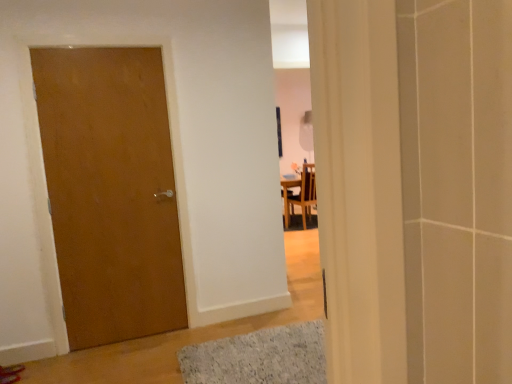
Describe the element at coordinates (110, 192) in the screenshot. I see `matte wood door at left` at that location.

The width and height of the screenshot is (512, 384). Find the location of `matte wood door at left`. matte wood door at left is located at coordinates (110, 192).

Can you confirm if matte wood door at left is shorter than wooden chair at center?

No, matte wood door at left is not shorter than wooden chair at center.

Is wooden chair at center completely or partially inside matte wood door at left?

Actually, wooden chair at center is outside matte wood door at left.

From the image's perspective, which one is positioned higher, matte wood door at left or wooden chair at center?

wooden chair at center.

From a real-world perspective, is matte wood door at left above or below wooden chair at center?

matte wood door at left is situated higher than wooden chair at center in the real world.

Is wooden chair at center positioned with its back to gray textured bath mat at lower center?

That's not correct — wooden chair at center is not looking away from gray textured bath mat at lower center.

Can we say wooden chair at center lies outside gray textured bath mat at lower center?

wooden chair at center is positioned outside gray textured bath mat at lower center.

Does wooden chair at center appear on the right side of gray textured bath mat at lower center?

Yes.

Which object is more forward, wooden chair at center or gray textured bath mat at lower center?

gray textured bath mat at lower center is in front.

From a real-world perspective, is gray textured bath mat at lower center physically above matte wood door at left?

Incorrect, from a real-world perspective, gray textured bath mat at lower center is lower than matte wood door at left.

Could you tell me if gray textured bath mat at lower center is facing matte wood door at left?

No.

Is point (278, 348) behind point (132, 85)?

No, (278, 348) is in front of (132, 85).

Is gray textured bath mat at lower center placed right next to matte wood door at left?

No, gray textured bath mat at lower center is not beside matte wood door at left.

Is wooden chair at center bigger than matte wood door at left?

Indeed, wooden chair at center has a larger size compared to matte wood door at left.

From a real-world perspective, is wooden chair at center located beneath matte wood door at left?

Yes, from a real-world perspective, wooden chair at center is below matte wood door at left.

In the scene shown: Can you confirm if wooden chair at center is wider than matte wood door at left?

Yes, wooden chair at center is wider than matte wood door at left.

Is wooden chair at center taller or shorter than matte wood door at left?

Clearly, wooden chair at center is shorter compared to matte wood door at left.

From the image's perspective, is matte wood door at left under gray textured bath mat at lower center?

No.

Considering the relative positions of matte wood door at left and gray textured bath mat at lower center in the image provided, is matte wood door at left to the left of gray textured bath mat at lower center from the viewer's perspective?

Correct, you'll find matte wood door at left to the left of gray textured bath mat at lower center.

Is gray textured bath mat at lower center surrounded by matte wood door at left?

No, gray textured bath mat at lower center is not inside matte wood door at left.

In the scene shown: Which object is thinner, matte wood door at left or gray textured bath mat at lower center?

matte wood door at left.

Is gray textured bath mat at lower center completely or partially outside of wooden chair at center?

Yes, gray textured bath mat at lower center is not within wooden chair at center.

Is gray textured bath mat at lower center directly adjacent to wooden chair at center?

No, gray textured bath mat at lower center is not next to wooden chair at center.

Based on the photo, which of these two, gray textured bath mat at lower center or wooden chair at center, stands shorter?

gray textured bath mat at lower center is shorter.

The width and height of the screenshot is (512, 384). What are the coordinates of `chair behind the matte wood door at left` in the screenshot? It's located at (303, 195).

Image resolution: width=512 pixels, height=384 pixels. I want to click on bath mat in front of the wooden chair at center, so click(259, 357).

When comparing their distances from wooden chair at center, does gray textured bath mat at lower center or matte wood door at left seem further?

matte wood door at left is further to wooden chair at center.

Looking at the image, which one is located closer to wooden chair at center, matte wood door at left or gray textured bath mat at lower center?

gray textured bath mat at lower center is closer to wooden chair at center.

Estimate the real-world distances between objects in this image. Which object is closer to gray textured bath mat at lower center, wooden chair at center or matte wood door at left?

matte wood door at left lies closer to gray textured bath mat at lower center than the other object.

Which object lies nearer to the anchor point matte wood door at left, gray textured bath mat at lower center or wooden chair at center?

Among the two, gray textured bath mat at lower center is located nearer to matte wood door at left.

Which object lies nearer to the anchor point gray textured bath mat at lower center, matte wood door at left or wooden chair at center?

Among the two, matte wood door at left is located nearer to gray textured bath mat at lower center.

Which object lies nearer to the anchor point matte wood door at left, wooden chair at center or gray textured bath mat at lower center?

gray textured bath mat at lower center.

What are the coordinates of `door between gray textured bath mat at lower center and wooden chair at center along the z-axis` in the screenshot? It's located at (110, 192).